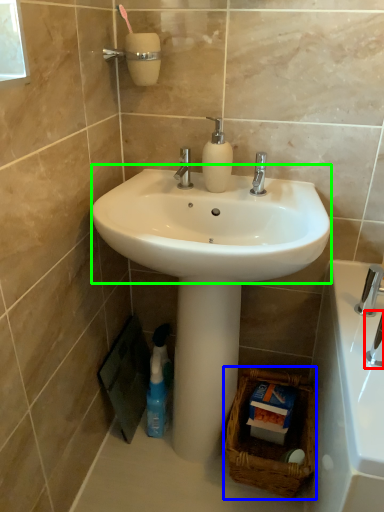
Question: Which object is positioned farthest from plumbing fixture (highlighted by a red box)? Select from basket (highlighted by a blue box) and sink (highlighted by a green box).

Choices:
 (A) basket
 (B) sink

Answer: (A)